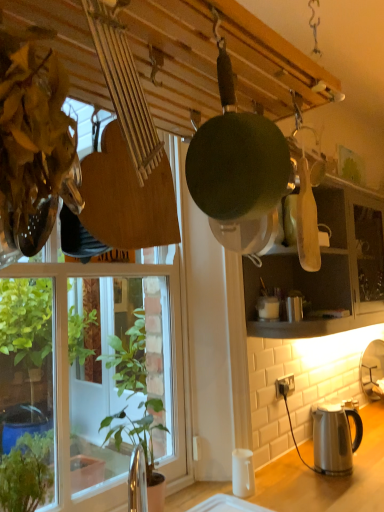
Question: Is white matte coffee cup at lower right next to green leafy plant at left, positioned as the second houseplant in front-to-back order?

Choices:
 (A) no
 (B) yes

Answer: (A)

Question: From a real-world perspective, is white matte coffee cup at lower right beneath green leafy plant at left, marked as the 1th houseplant in a right-to-left arrangement?

Choices:
 (A) yes
 (B) no

Answer: (A)

Question: From the image's perspective, is white matte coffee cup at lower right located above green leafy plant at left, marked as the 1th houseplant in a right-to-left arrangement?

Choices:
 (A) no
 (B) yes

Answer: (A)

Question: Is white matte coffee cup at lower right at the left side of green leafy plant at left, which ranks as the first houseplant in back-to-front order?

Choices:
 (A) no
 (B) yes

Answer: (A)

Question: Is white matte coffee cup at lower right completely or partially outside of green leafy plant at left, which ranks as the first houseplant in back-to-front order?

Choices:
 (A) no
 (B) yes

Answer: (B)

Question: From a real-world perspective, does white matte coffee cup at lower right stand above green leafy plant at left, positioned as the second houseplant in front-to-back order?

Choices:
 (A) yes
 (B) no

Answer: (B)

Question: Can you confirm if white plastic power outlet at lower right is smaller than satin silver kettle at lower right?

Choices:
 (A) no
 (B) yes

Answer: (B)

Question: Does white plastic power outlet at lower right have a lesser height compared to satin silver kettle at lower right?

Choices:
 (A) no
 (B) yes

Answer: (B)

Question: Would you say white plastic power outlet at lower right is outside satin silver kettle at lower right?

Choices:
 (A) no
 (B) yes

Answer: (B)

Question: Is white plastic power outlet at lower right looking in the opposite direction of satin silver kettle at lower right?

Choices:
 (A) yes
 (B) no

Answer: (B)

Question: Can you confirm if white plastic power outlet at lower right is bigger than satin silver kettle at lower right?

Choices:
 (A) no
 (B) yes

Answer: (A)

Question: From a real-world perspective, does white plastic power outlet at lower right stand above satin silver kettle at lower right?

Choices:
 (A) yes
 (B) no

Answer: (A)

Question: Considering the relative sizes of satin silver kettle at lower right and white matte coffee cup at lower right in the image provided, is satin silver kettle at lower right wider than white matte coffee cup at lower right?

Choices:
 (A) no
 (B) yes

Answer: (B)